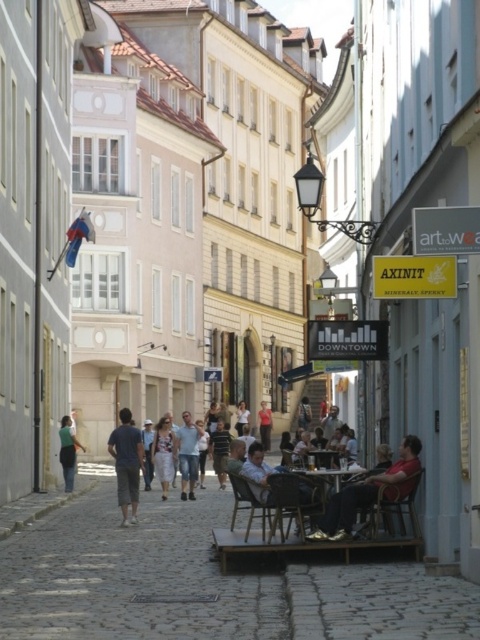
You are a tourist carrying a backpack and want to sit down to rest. You see the light blue denim shorts at center and the wooden table at center in the scene. Which one is closer to you?

The light blue denim shorts at center and wooden table at center are 18.79 meters apart, so it is impossible to determine which one is closer without additional information about their exact positions relative to your current location.